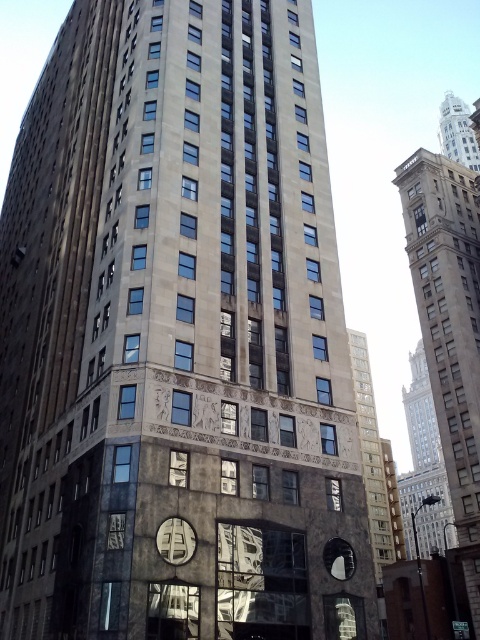
Question: From the image, what is the correct spatial relationship of gray stone tower at right in relation to white marble clock tower at upper right?

Choices:
 (A) below
 (B) above

Answer: (A)

Question: Which object is the farthest from the beige stone tower at right?

Choices:
 (A) white marble clock tower at upper right
 (B) gray stone clock at center
 (C) gray stone tower at right

Answer: (A)

Question: Which object appears farthest from the camera in this image?

Choices:
 (A) beige stone tower at right
 (B) gray stone clock at center
 (C) marble-like stone tower at center

Answer: (A)

Question: Which object appears farthest from the camera in this image?

Choices:
 (A) marble-like stone tower at center
 (B) gray stone clock at center
 (C) white marble clock tower at upper right

Answer: (C)

Question: Is gray stone tower at right behind marble-like stone tower at center?

Choices:
 (A) no
 (B) yes

Answer: (B)

Question: Observing the image, what is the correct spatial positioning of beige stone tower at right in reference to gray stone clock at center?

Choices:
 (A) above
 (B) below

Answer: (A)